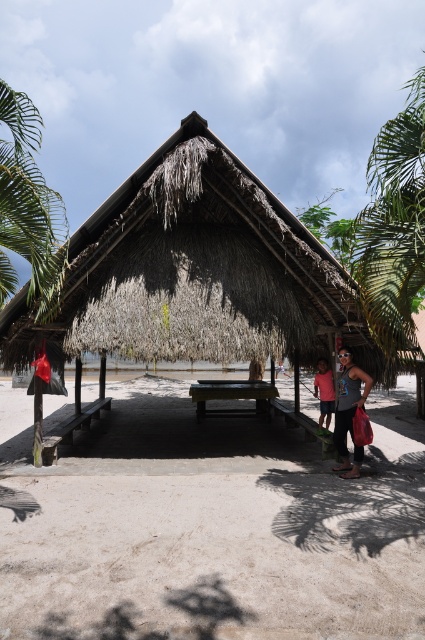
You are planning to set up a small tent for a beach picnic. The tent requires a clear space of 20 feet between the light brown sandy beach at lower center and the smooth wooden picnic table at center. Is there enough space available?

The distance between the light brown sandy beach at lower center and the smooth wooden picnic table at center is 21.09 feet, which is more than the required 20 feet. Therefore, there is enough space to set up the tent.

You are planning to set up a small tent for a beach picnic. The tent requires a flat area larger than the smooth wooden picnic table at center. Can the light brown sandy beach at lower center accommodate the tent?

The light brown sandy beach at lower center is bigger than the smooth wooden picnic table at center, so yes, the tent can be accommodated there since the sandy beach area is larger.

You are a visitor to this beach area and want to place a small umbrella between the green leafy palm tree at left and the matte pink shirt at lower right. Which object should you position the umbrella closer to to ensure it fits within the available space?

The green leafy palm tree at left is wider than the matte pink shirt at lower right. To ensure the umbrella fits within the available space, position it closer to the matte pink shirt at lower right since it occupies less width.